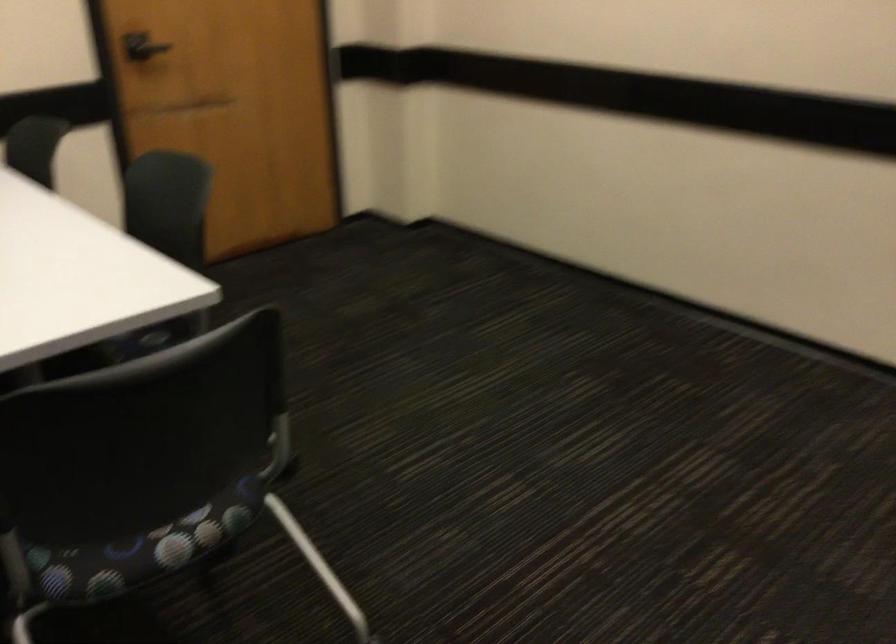
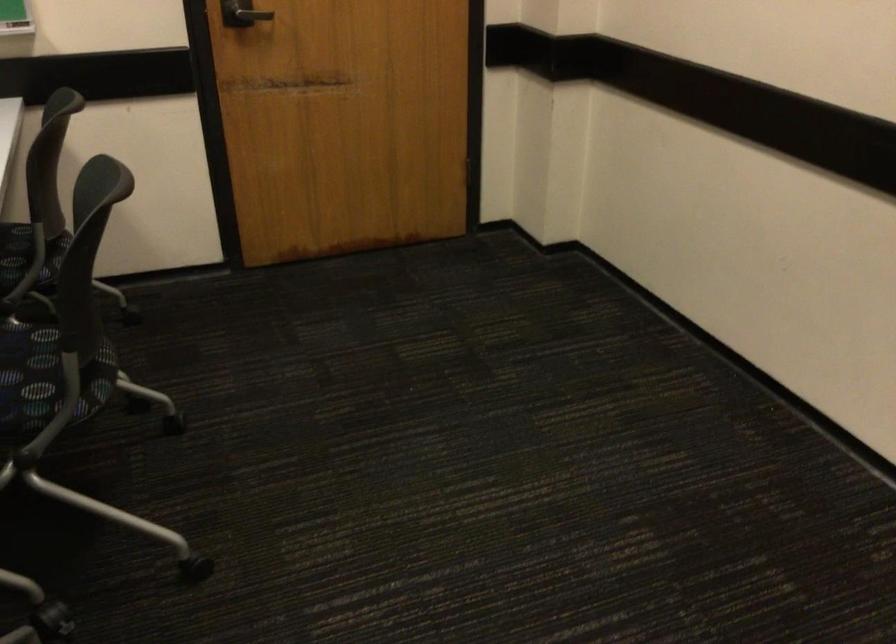
In the second image, find the point that corresponds to (x=143, y=334) in the first image.

(47, 374)